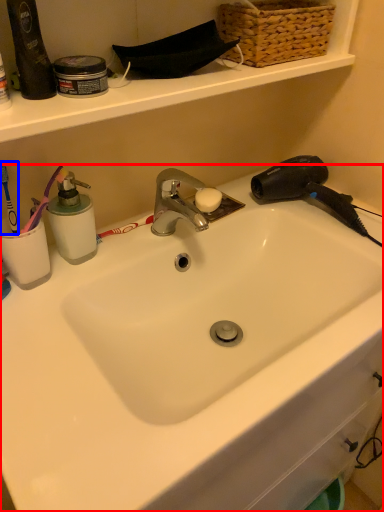
Question: Which of the following is the closest to the observer, sink (highlighted by a red box) or brush (highlighted by a blue box)?

Choices:
 (A) sink
 (B) brush

Answer: (A)